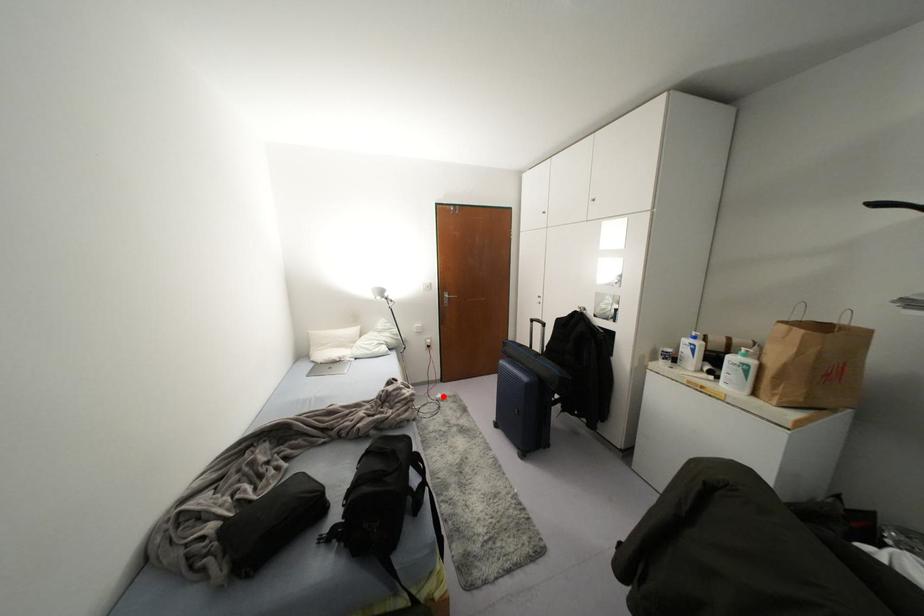
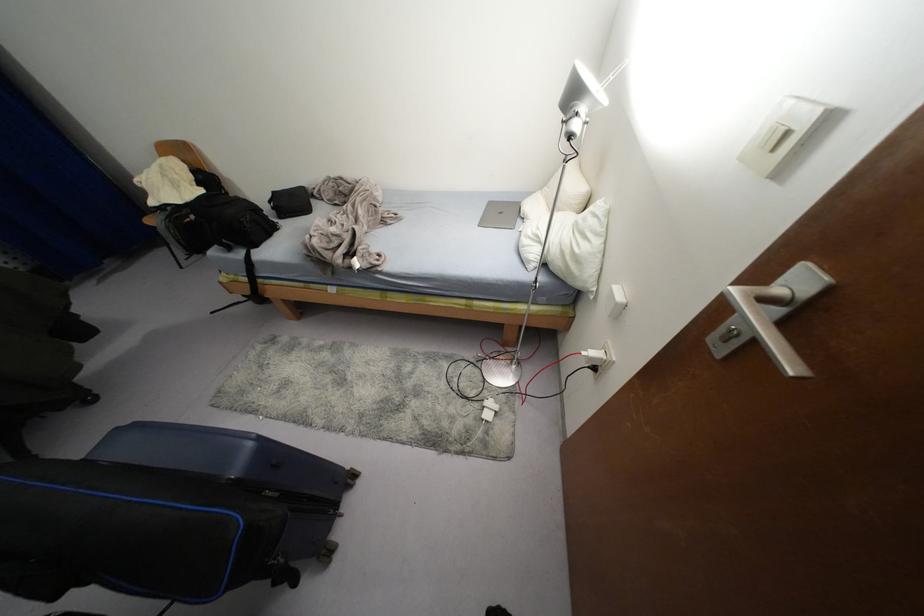
Locate, in the second image, the point that corresponds to the highlighted location in the first image.

(487, 416)